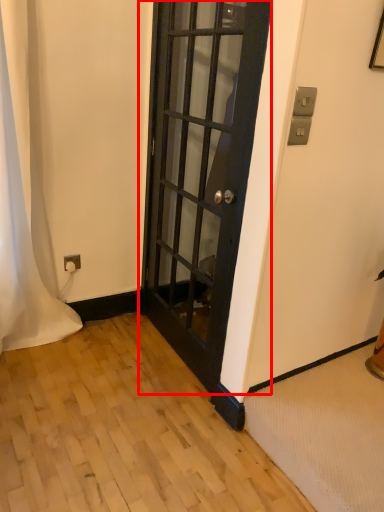
Question: From the image's perspective, considering the relative positions of door (annotated by the red box) and curtain in the image provided, where is door (annotated by the red box) located with respect to the staircase?

Choices:
 (A) above
 (B) below

Answer: (B)